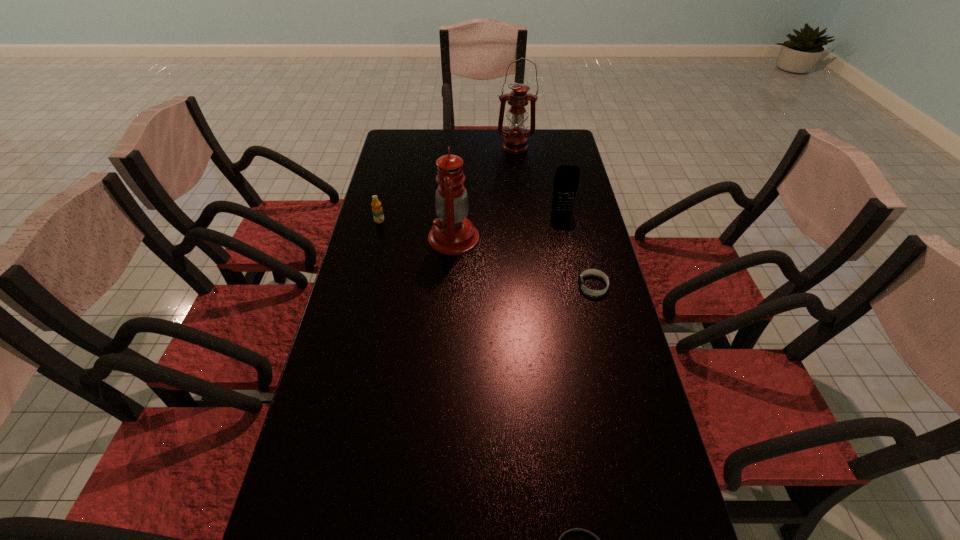
This screenshot has width=960, height=540. Find the location of `vacant region located on the front of the farthest object`. vacant region located on the front of the farthest object is located at coordinates (520, 198).

I want to click on vacant point located 0.130m on the front of the nearer oil lamp, so click(450, 288).

Where is `free space located on the screen of the second farthest object`? This screenshot has height=540, width=960. free space located on the screen of the second farthest object is located at coordinates (576, 281).

Image resolution: width=960 pixels, height=540 pixels. Find the location of `vacant space positioned on the label of the leftmost object`. vacant space positioned on the label of the leftmost object is located at coordinates (372, 251).

Where is `vacant region located on the outer surface of the second nearest object`? vacant region located on the outer surface of the second nearest object is located at coordinates (512, 286).

The image size is (960, 540). What are the coordinates of `vacant space located 0.350m on the outer surface of the second nearest object` in the screenshot? It's located at (455, 286).

In order to click on vacant space located 0.150m on the outer surface of the second nearest object in this screenshot , I will do `click(526, 286)`.

Identify the location of object at the far edge. The width and height of the screenshot is (960, 540). (515, 140).

Identify the location of object located in the left edge section of the desktop. This screenshot has height=540, width=960. (377, 210).

Find the location of a particular element. The width and height of the screenshot is (960, 540). oil lamp located at the right edge is located at coordinates (515, 140).